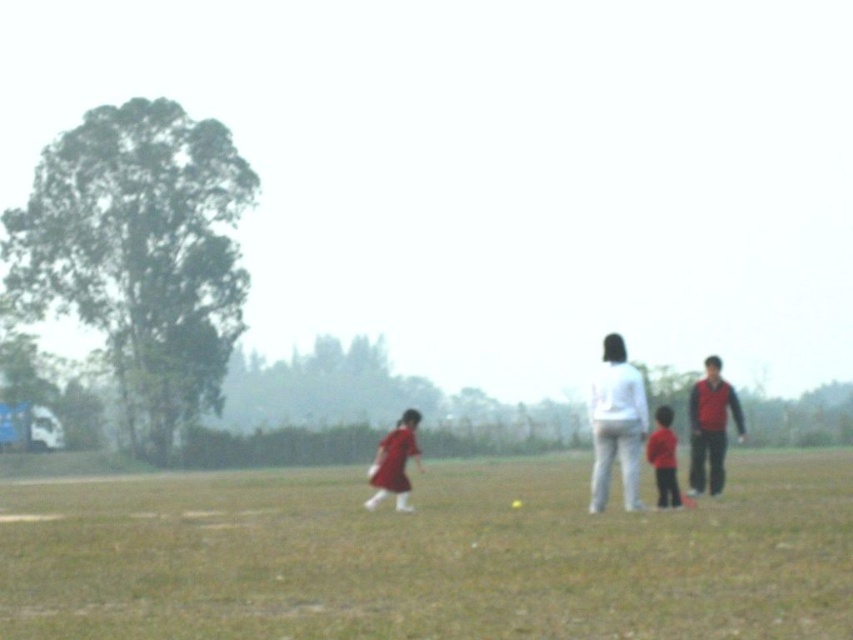
You are a photographer trying to capture a candid shot of the two adults and child walking away. The white matte pants at center and matte red shirt at center are part of their clothing. Which clothing item would appear larger in your photo?

The white matte pants at center would appear larger in the photo because it is much taller than the matte red shirt at center.

You are a photographer trying to capture a candid shot of the two adults and the child in the scene. The adults are wearing white cotton pants at right and white matte pants at center. If your camera has a focus range of 10 inches, will you be able to capture both pairs of pants in focus?

The distance between the white cotton pants at right and white matte pants at center is 10.15 inches, which exceeds the camera focus range of 10 inches. Therefore, you cannot capture both pairs of pants in focus simultaneously.

You are a photographer trying to capture a photo of the two adults and a child in the midground. You notice the white cotton pants at right and white matte pants at center. Which pair of pants is shorter in height?

The white cotton pants at right has a lesser height compared to the white matte pants at center, so the white cotton pants at right is shorter in height.